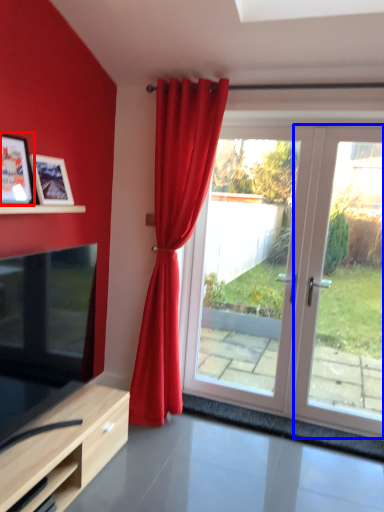
Question: Which of the following is the farthest to the observer, picture frame (highlighted by a red box) or glass door (highlighted by a blue box)?

Choices:
 (A) picture frame
 (B) glass door

Answer: (B)